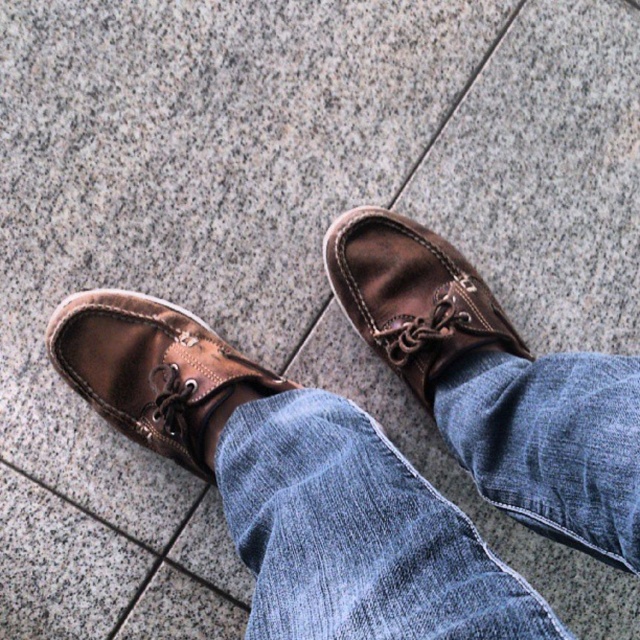
Question: Estimate the real-world distances between objects in this image. Which object is farther from the denim at center?

Choices:
 (A) leather shoe at center
 (B) brown leather shoe at center

Answer: (B)

Question: Is denim at center below brown leather shoe at center?

Choices:
 (A) no
 (B) yes

Answer: (B)

Question: Is brown leather shoe at center bigger than leather shoe at center?

Choices:
 (A) yes
 (B) no

Answer: (A)

Question: Which of the following is the farthest from the observer?

Choices:
 (A) (456, 266)
 (B) (552, 515)
 (C) (209, 444)

Answer: (A)

Question: Is the position of brown leather shoe at center more distant than that of leather shoe at center?

Choices:
 (A) yes
 (B) no

Answer: (B)

Question: Which of the following is the farthest from the observer?

Choices:
 (A) brown leather shoe at center
 (B) denim at center

Answer: (A)